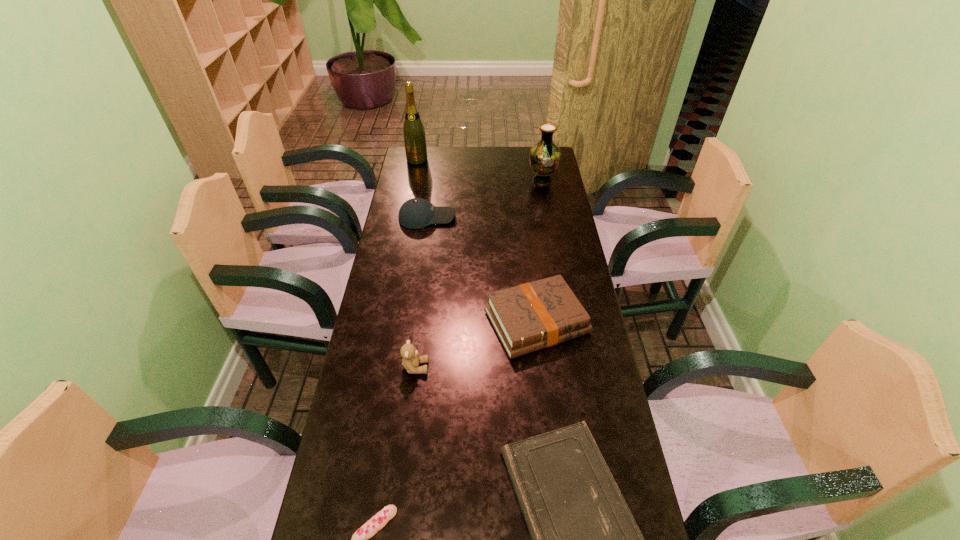
The width and height of the screenshot is (960, 540). I want to click on object that is at the far right corner, so click(544, 156).

In the image, there is a desktop. Identify the location of vacant area at the far edge. The width and height of the screenshot is (960, 540). (478, 164).

This screenshot has width=960, height=540. I want to click on vacant space at the left edge of the desktop, so click(x=384, y=316).

The height and width of the screenshot is (540, 960). In the image, there is a desktop. What are the coordinates of `vacant space at the right edge` in the screenshot? It's located at coord(597,363).

Identify the location of vacant region between the baseball cap and the hardback book. The image size is (960, 540). click(x=482, y=269).

Image resolution: width=960 pixels, height=540 pixels. What are the coordinates of `free space between the farthest object and the fifth nearest object` in the screenshot? It's located at (422, 188).

Where is `unoccupied position between the vase and the fifth shortest object`? The height and width of the screenshot is (540, 960). unoccupied position between the vase and the fifth shortest object is located at coordinates tap(479, 274).

The width and height of the screenshot is (960, 540). I want to click on vacant space that is in between the third farthest object and the teddy bear, so click(x=421, y=292).

Identify which object is located as the third nearest to the eclair. Please provide its 2D coordinates. Your answer should be formatted as a tuple, i.e. [(x, y)], where the tuple contains the x and y coordinates of a point satisfying the conditions above.

[(532, 316)]

The image size is (960, 540). Find the location of `object that is the sixth closest to the hardback book`. object that is the sixth closest to the hardback book is located at coordinates (413, 131).